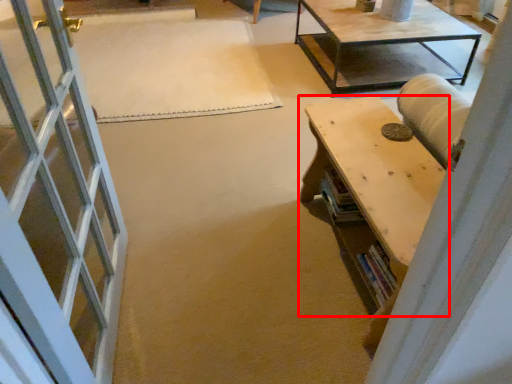
Question: From the image's perspective, what is the correct spatial relationship of table (annotated by the red box) in relation to mat?

Choices:
 (A) above
 (B) below

Answer: (B)